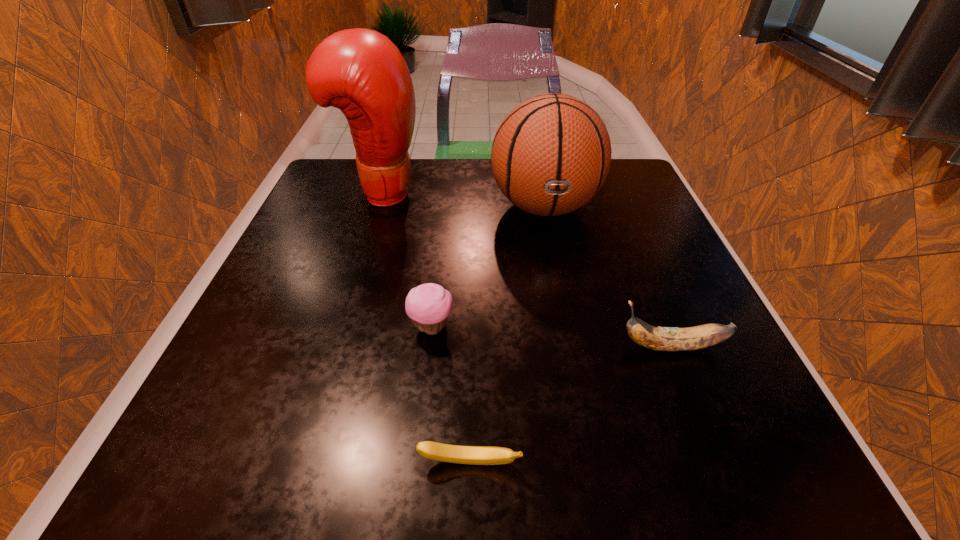
You are a GUI agent. You are given a task and a screenshot of the screen. Output one action in this format:
    pyautogui.click(x=<x>, y=<y>)
    Task: Click on the free spot between the cupcake and the nearer banana
    
    Given the screenshot: What is the action you would take?
    pyautogui.click(x=450, y=395)

The image size is (960, 540). In order to click on empty location between the boxing glove and the cupcake in this screenshot , I will do `click(406, 259)`.

You are a GUI agent. You are given a task and a screenshot of the screen. Output one action in this format:
    pyautogui.click(x=<x>, y=<y>)
    Task: Click on the free area in between the cupcake and the nearest object
    
    Given the screenshot: What is the action you would take?
    pyautogui.click(x=450, y=395)

The image size is (960, 540). Find the location of `free space between the cupcake and the shortest object`. free space between the cupcake and the shortest object is located at coordinates (450, 395).

Locate an element on the screen. free space between the nearest object and the fourth shortest object is located at coordinates tap(507, 335).

The width and height of the screenshot is (960, 540). I want to click on unoccupied position between the fourth shortest object and the tallest object, so click(463, 199).

What are the coordinates of `vacant area that lies between the cupcake and the tallest object` in the screenshot? It's located at (406, 259).

You are a GUI agent. You are given a task and a screenshot of the screen. Output one action in this format:
    pyautogui.click(x=<x>, y=<y>)
    Task: Click on the free spot between the right banana and the cupcake
    
    Given the screenshot: What is the action you would take?
    pyautogui.click(x=552, y=337)

Locate an element on the screen. Image resolution: width=960 pixels, height=540 pixels. object that is the second closest to the nearest object is located at coordinates (668, 339).

Locate which object ranks second in proximity to the nearest object. Please provide its 2D coordinates. Your answer should be formatted as a tuple, i.e. [(x, y)], where the tuple contains the x and y coordinates of a point satisfying the conditions above.

[(668, 339)]